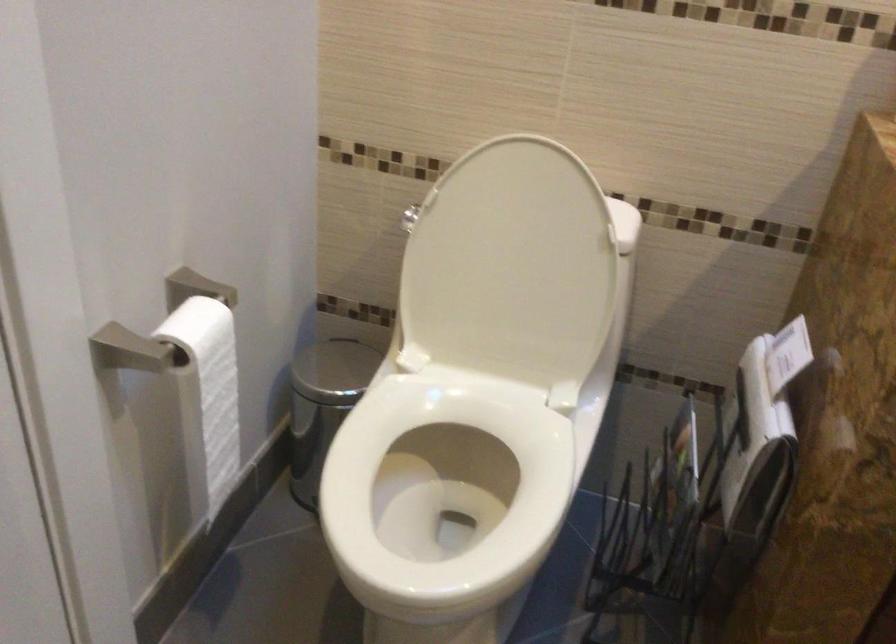
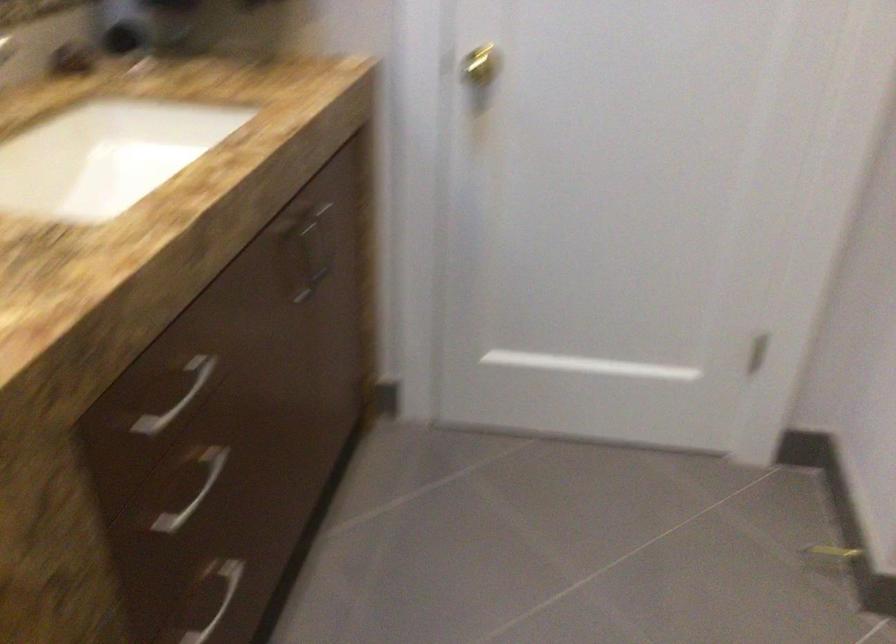
How did the camera likely rotate?

The camera rotated toward right-down.